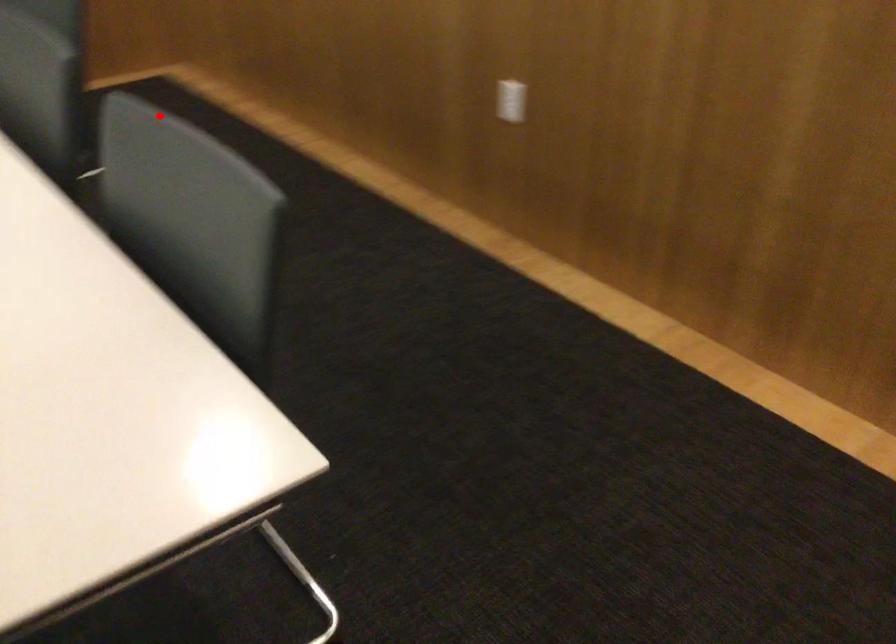
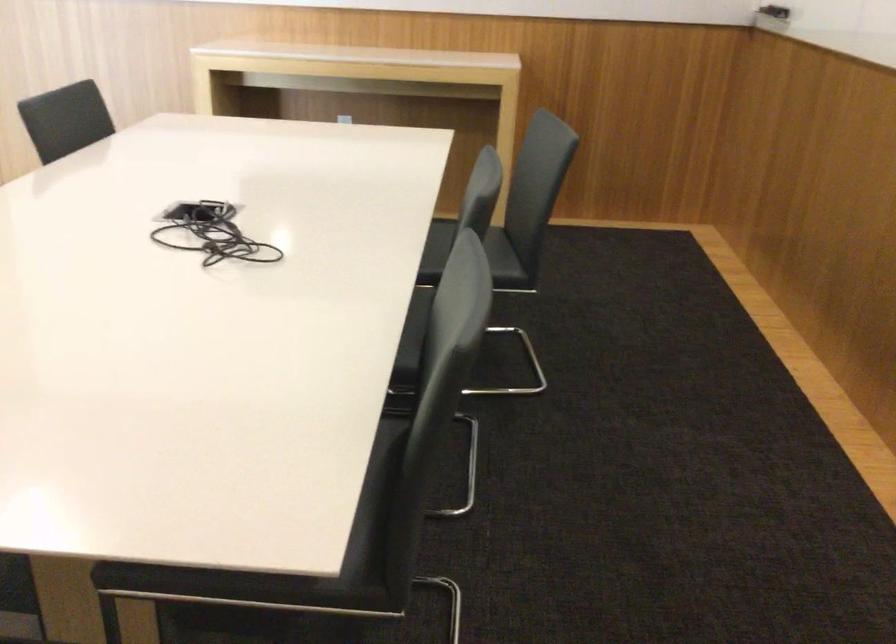
The point at the highlighted location is marked in the first image. Where is the corresponding point in the second image?

(470, 256)